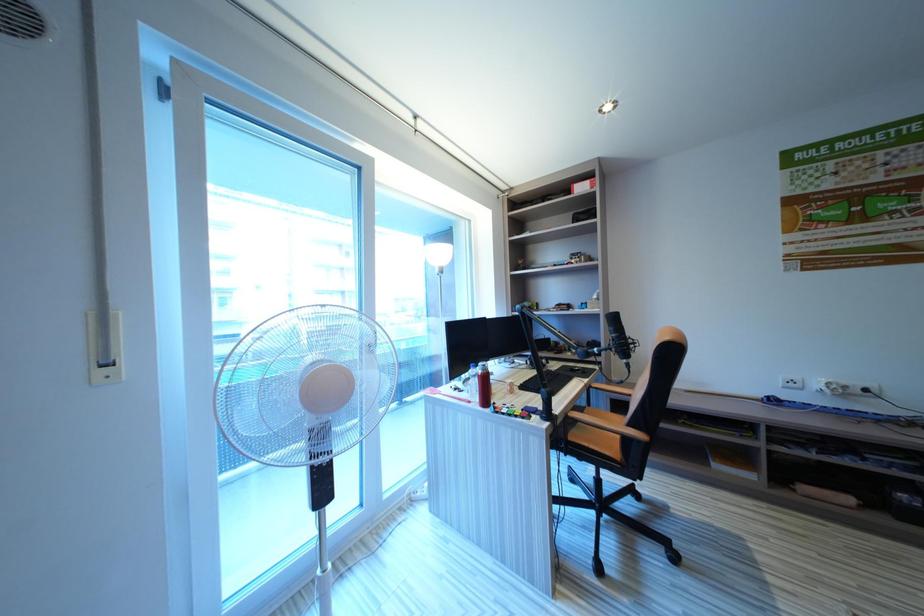
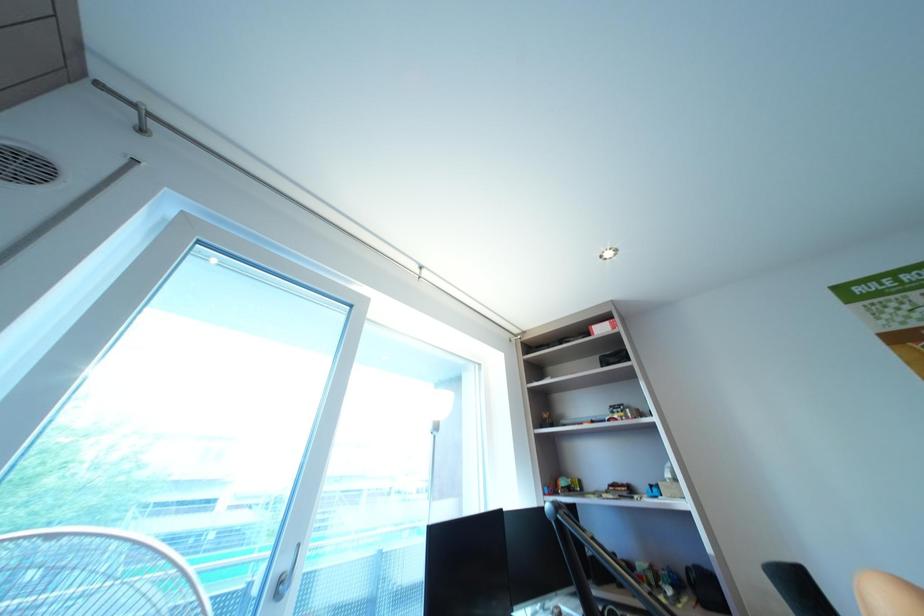
Question: How did the camera likely rotate?

Choices:
 (A) Left
 (B) Right
 (C) Up
 (D) Down

Answer: (C)